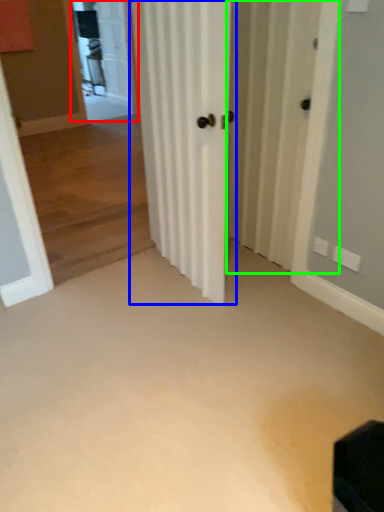
Question: Estimate the real-world distances between objects in this image. Which object is farther from screen door (highlighted by a red box), door (highlighted by a blue box) or screen door (highlighted by a green box)?

Choices:
 (A) door
 (B) screen door

Answer: (A)